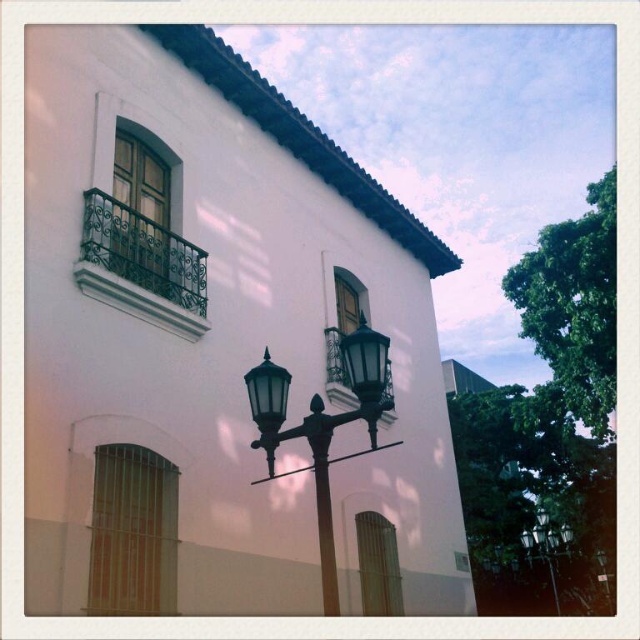
Consider the image. You are a city planner evaluating the placement of two street lights in front of a historic building. The bronze textured street light at center and the black glass street light at center are both candidates. Based on their heights, which one would be less likely to block the view of the building facade?

The bronze textured street light at center is shorter than the black glass street light at center, so the bronze textured street light at center would be less likely to block the view of the building facade.

You are a city planner checking the width of two street lights in front of a building. The bronze textured street light at center and the black glass street light at center are both in view. Which one has a narrower width?

The bronze textured street light at center has a narrower width than the black glass street light at center according to the description.